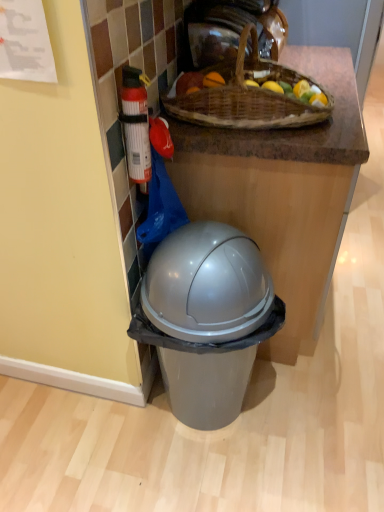
Question: From a real-world perspective, is brown woven picnic basket at upper center physically above white plastic fire extinguisher at left?

Choices:
 (A) no
 (B) yes

Answer: (B)

Question: Does brown woven picnic basket at upper center have a greater width compared to white plastic fire extinguisher at left?

Choices:
 (A) yes
 (B) no

Answer: (A)

Question: From the image's perspective, would you say brown woven picnic basket at upper center is shown under white plastic fire extinguisher at left?

Choices:
 (A) no
 (B) yes

Answer: (A)

Question: Can you confirm if brown woven picnic basket at upper center is thinner than white plastic fire extinguisher at left?

Choices:
 (A) no
 (B) yes

Answer: (A)

Question: Does brown woven picnic basket at upper center come behind white plastic fire extinguisher at left?

Choices:
 (A) yes
 (B) no

Answer: (A)

Question: Does brown woven picnic basket at upper center turn towards white plastic fire extinguisher at left?

Choices:
 (A) yes
 (B) no

Answer: (B)

Question: Does white plastic fire extinguisher at left have a greater height compared to brown woven picnic basket at upper center?

Choices:
 (A) no
 (B) yes

Answer: (B)

Question: Is white plastic fire extinguisher at left located outside brown woven picnic basket at upper center?

Choices:
 (A) yes
 (B) no

Answer: (A)

Question: From the image's perspective, is white plastic fire extinguisher at left located above brown woven picnic basket at upper center?

Choices:
 (A) no
 (B) yes

Answer: (A)

Question: Is white plastic fire extinguisher at left positioned in front of brown woven picnic basket at upper center?

Choices:
 (A) no
 (B) yes

Answer: (B)

Question: Is white plastic fire extinguisher at left turned away from brown woven picnic basket at upper center?

Choices:
 (A) yes
 (B) no

Answer: (B)

Question: Is white plastic fire extinguisher at left positioned behind brown woven picnic basket at upper center?

Choices:
 (A) yes
 (B) no

Answer: (B)

Question: Considering the positions of brown woven picnic basket at upper center and white plastic fire extinguisher at left in the image, is brown woven picnic basket at upper center wider or thinner than white plastic fire extinguisher at left?

Choices:
 (A) thin
 (B) wide

Answer: (B)